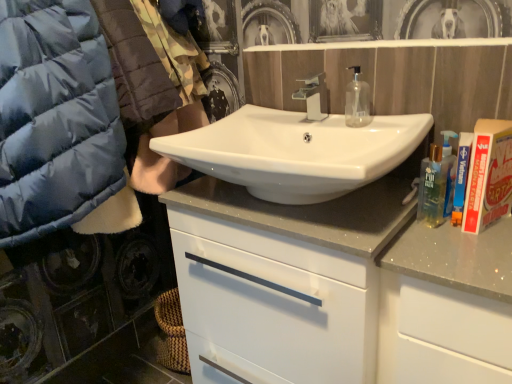
Question: Does white glossy cabinet at center have a smaller size compared to transparent plastic mouthwash at center?

Choices:
 (A) yes
 (B) no

Answer: (B)

Question: From a real-world perspective, is white glossy cabinet at center below transparent plastic mouthwash at center?

Choices:
 (A) yes
 (B) no

Answer: (A)

Question: From a real-world perspective, is white glossy cabinet at center located higher than transparent plastic mouthwash at center?

Choices:
 (A) no
 (B) yes

Answer: (A)

Question: Does white glossy cabinet at center appear on the left side of transparent plastic mouthwash at center?

Choices:
 (A) yes
 (B) no

Answer: (A)

Question: Does white glossy cabinet at center appear on the right side of transparent plastic mouthwash at center?

Choices:
 (A) yes
 (B) no

Answer: (B)

Question: Considering the relative sizes of white glossy cabinet at center and transparent plastic mouthwash at center in the image provided, is white glossy cabinet at center bigger than transparent plastic mouthwash at center?

Choices:
 (A) no
 (B) yes

Answer: (B)

Question: Is silver metallic faucet at center facing towards white glossy sink at center?

Choices:
 (A) yes
 (B) no

Answer: (B)

Question: Is silver metallic faucet at center positioned beyond the bounds of white glossy sink at center?

Choices:
 (A) no
 (B) yes

Answer: (B)

Question: From the image's perspective, is silver metallic faucet at center located beneath white glossy sink at center?

Choices:
 (A) yes
 (B) no

Answer: (B)

Question: Is silver metallic faucet at center positioned before white glossy sink at center?

Choices:
 (A) no
 (B) yes

Answer: (A)

Question: Is silver metallic faucet at center not near white glossy sink at center?

Choices:
 (A) no
 (B) yes

Answer: (A)

Question: From the image's perspective, would you say silver metallic faucet at center is positioned over white glossy sink at center?

Choices:
 (A) no
 (B) yes

Answer: (B)

Question: From a real-world perspective, does transparent plastic mouthwash at center sit lower than matte blue puffer jacket at left?

Choices:
 (A) yes
 (B) no

Answer: (A)